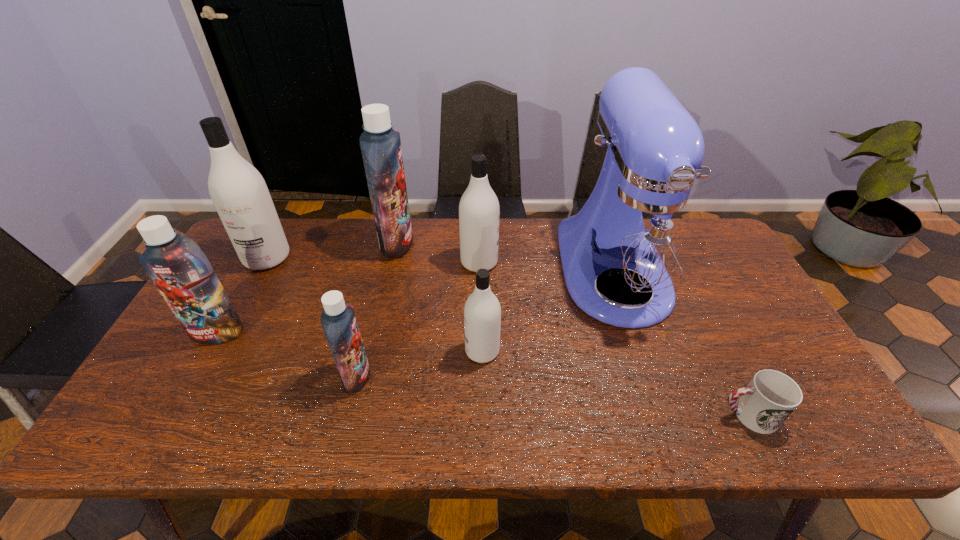
Identify the location of vacant area at the right edge. (733, 293).

Identify the location of vacant space at the near left corner. This screenshot has height=540, width=960. (177, 428).

The width and height of the screenshot is (960, 540). Find the location of `free spot between the leftmost white shampoo and the second biggest blue shampoo`. free spot between the leftmost white shampoo and the second biggest blue shampoo is located at coordinates point(242,295).

The height and width of the screenshot is (540, 960). In order to click on vacant region between the red cup and the second nearest blue shampoo in this screenshot , I will do `click(483, 374)`.

This screenshot has width=960, height=540. Identify the location of free point between the second smallest white shampoo and the mixer. (546, 266).

Find the location of a particular element. The image size is (960, 540). free space between the biggest blue shampoo and the cup is located at coordinates (572, 329).

Find the location of a particular element. empty space that is in between the biggest blue shampoo and the smallest blue shampoo is located at coordinates (376, 309).

The width and height of the screenshot is (960, 540). I want to click on vacant area that lies between the second biggest white shampoo and the cup, so click(x=613, y=339).

Identify the location of vacant area that lies between the smallest white shampoo and the red cup. Image resolution: width=960 pixels, height=540 pixels. (615, 383).

In order to click on free spot between the farthest blue shampoo and the biggest white shampoo in this screenshot , I will do `click(332, 251)`.